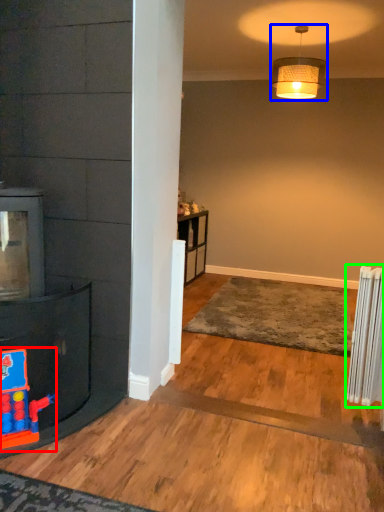
Question: Considering the real-world distances, which object is closest to toy (highlighted by a red box)? lamp (highlighted by a blue box) or radiator (highlighted by a green box).

Choices:
 (A) lamp
 (B) radiator

Answer: (B)